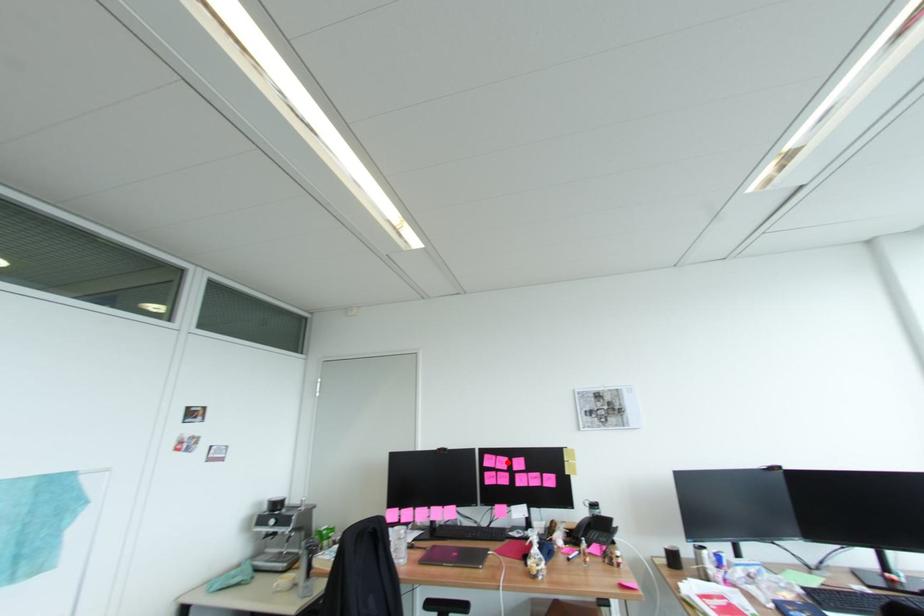
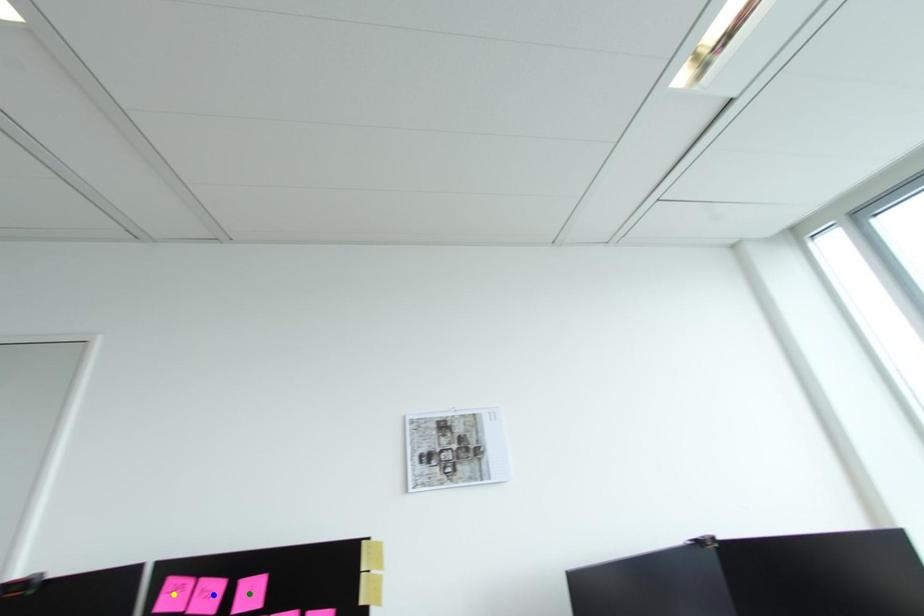
Question: I am providing you with two images of the same scene from different viewpoints. A red point is marked on the first image. You are given multiple points on the second image. Which point in image 2 is actually the same real-world point as the red point in image 1?

Choices:
 (A) blue point
 (B) green point
 (C) yellow point

Answer: (A)